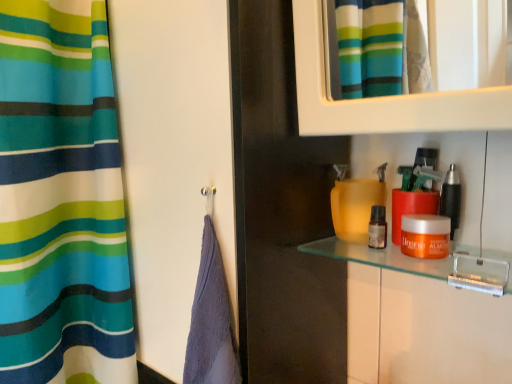
The image size is (512, 384). I want to click on transparent glass screen door at center, so click(x=173, y=159).

Measure the distance between point (379, 247) and camera.

They are 25.67 inches apart.

Describe the element at coordinates (425, 236) in the screenshot. I see `orange matte jar at right, which appears as the second cosmetic when viewed from the right` at that location.

The width and height of the screenshot is (512, 384). I want to click on translucent glass shelf at center, so click(388, 256).

What do you see at coordinates (388, 256) in the screenshot?
I see `translucent glass shelf at center` at bounding box center [388, 256].

Locate an element on the screen. The image size is (512, 384). metallic black razor at right, the 3th cosmetic in the left-to-right sequence is located at coordinates (451, 198).

From the image's perspective, does transparent glass screen door at center appear higher than metallic black razor at right, the first cosmetic viewed from the right?

No, from the image's perspective, transparent glass screen door at center is not over metallic black razor at right, the first cosmetic viewed from the right.

Relative to metallic black razor at right, the 3th cosmetic in the left-to-right sequence, is transparent glass screen door at center in front or behind?

Visually, transparent glass screen door at center is located in front of metallic black razor at right, the 3th cosmetic in the left-to-right sequence.

Is transparent glass screen door at center bigger than metallic black razor at right, the first cosmetic viewed from the right?

Yes, transparent glass screen door at center is bigger than metallic black razor at right, the first cosmetic viewed from the right.

Is translucent amber bottle at center, marked as the 1th cosmetic in a left-to-right arrangement, at the right side of orange matte jar at right, which ranks as the 2th cosmetic in left-to-right order?

No, translucent amber bottle at center, marked as the 1th cosmetic in a left-to-right arrangement, is not to the right of orange matte jar at right, which ranks as the 2th cosmetic in left-to-right order.

Considering the relative sizes of translucent amber bottle at center, marked as the 1th cosmetic in a left-to-right arrangement, and orange matte jar at right, which ranks as the 2th cosmetic in left-to-right order, in the image provided, is translucent amber bottle at center, marked as the 1th cosmetic in a left-to-right arrangement, wider than orange matte jar at right, which ranks as the 2th cosmetic in left-to-right order,?

In fact, translucent amber bottle at center, marked as the 1th cosmetic in a left-to-right arrangement, might be narrower than orange matte jar at right, which ranks as the 2th cosmetic in left-to-right order.

From the image's perspective, which object appears higher, translucent amber bottle at center, the 3th cosmetic in the right-to-left sequence, or orange matte jar at right, which appears as the second cosmetic when viewed from the right?

translucent amber bottle at center, the 3th cosmetic in the right-to-left sequence, is shown above in the image.

Which of these two, translucent amber bottle at center, marked as the 1th cosmetic in a left-to-right arrangement, or orange matte jar at right, which appears as the second cosmetic when viewed from the right, stands taller?

translucent amber bottle at center, marked as the 1th cosmetic in a left-to-right arrangement, is taller.

Considering the sizes of transparent glass screen door at center and translucent amber bottle at center, marked as the 1th cosmetic in a left-to-right arrangement, in the image, is transparent glass screen door at center wider or thinner than translucent amber bottle at center, marked as the 1th cosmetic in a left-to-right arrangement,?

Considering their sizes, transparent glass screen door at center looks broader than translucent amber bottle at center, marked as the 1th cosmetic in a left-to-right arrangement.

Does transparent glass screen door at center appear on the left side of translucent amber bottle at center, the 3th cosmetic in the right-to-left sequence?

Indeed, transparent glass screen door at center is positioned on the left side of translucent amber bottle at center, the 3th cosmetic in the right-to-left sequence.

How much distance is there between transparent glass screen door at center and translucent amber bottle at center, the 3th cosmetic in the right-to-left sequence?

transparent glass screen door at center is 13.84 inches away from translucent amber bottle at center, the 3th cosmetic in the right-to-left sequence.

From the image's perspective, is transparent glass screen door at center above translucent amber bottle at center, marked as the 1th cosmetic in a left-to-right arrangement?

Yes, from the image's perspective, transparent glass screen door at center is on top of translucent amber bottle at center, marked as the 1th cosmetic in a left-to-right arrangement.

Can you tell me how much orange matte jar at right, which appears as the second cosmetic when viewed from the right, and translucent amber bottle at center, the 3th cosmetic in the right-to-left sequence, differ in facing direction?

The facing directions of orange matte jar at right, which appears as the second cosmetic when viewed from the right, and translucent amber bottle at center, the 3th cosmetic in the right-to-left sequence, are 2.64 degrees apart.

Starting from the orange matte jar at right, which appears as the second cosmetic when viewed from the right, which cosmetic is the 2nd one behind? Please provide its 2D coordinates.

[(377, 228)]

Considering the sizes of orange matte jar at right, which ranks as the 2th cosmetic in left-to-right order, and translucent amber bottle at center, the 3th cosmetic in the right-to-left sequence, in the image, is orange matte jar at right, which ranks as the 2th cosmetic in left-to-right order, bigger or smaller than translucent amber bottle at center, the 3th cosmetic in the right-to-left sequence,?

In the image, orange matte jar at right, which ranks as the 2th cosmetic in left-to-right order, appears to be larger than translucent amber bottle at center, the 3th cosmetic in the right-to-left sequence.

Does orange matte jar at right, which ranks as the 2th cosmetic in left-to-right order, appear on the left side of translucent amber bottle at center, the 3th cosmetic in the right-to-left sequence?

No, orange matte jar at right, which ranks as the 2th cosmetic in left-to-right order, is not to the left of translucent amber bottle at center, the 3th cosmetic in the right-to-left sequence.

How far apart are translucent amber bottle at center, marked as the 1th cosmetic in a left-to-right arrangement, and transparent glass screen door at center?

translucent amber bottle at center, marked as the 1th cosmetic in a left-to-right arrangement, is 13.84 inches from transparent glass screen door at center.

Which is more to the right, translucent amber bottle at center, the 3th cosmetic in the right-to-left sequence, or transparent glass screen door at center?

From the viewer's perspective, translucent amber bottle at center, the 3th cosmetic in the right-to-left sequence, appears more on the right side.

Is translucent amber bottle at center, marked as the 1th cosmetic in a left-to-right arrangement, bigger than transparent glass screen door at center?

Actually, translucent amber bottle at center, marked as the 1th cosmetic in a left-to-right arrangement, might be smaller than transparent glass screen door at center.

How different are the orientations of translucent amber bottle at center, marked as the 1th cosmetic in a left-to-right arrangement, and transparent glass screen door at center in degrees?

There is a 0.441-degree angle between the facing directions of translucent amber bottle at center, marked as the 1th cosmetic in a left-to-right arrangement, and transparent glass screen door at center.

Is metallic black razor at right, the first cosmetic viewed from the right, touching translucent glass shelf at center?

No, metallic black razor at right, the first cosmetic viewed from the right, is not making contact with translucent glass shelf at center.

Is metallic black razor at right, the first cosmetic viewed from the right, taller than translucent glass shelf at center?

Yes, metallic black razor at right, the first cosmetic viewed from the right, is taller than translucent glass shelf at center.

How different are the orientations of metallic black razor at right, the 3th cosmetic in the left-to-right sequence, and translucent glass shelf at center in degrees?

There is a 0.00383-degree angle between the facing directions of metallic black razor at right, the 3th cosmetic in the left-to-right sequence, and translucent glass shelf at center.

Considering the sizes of objects metallic black razor at right, the first cosmetic viewed from the right, and translucent glass shelf at center in the image provided, who is bigger, metallic black razor at right, the first cosmetic viewed from the right, or translucent glass shelf at center?

translucent glass shelf at center is bigger.

Can you confirm if metallic black razor at right, the 3th cosmetic in the left-to-right sequence, is smaller than transparent glass screen door at center?

Yes, metallic black razor at right, the 3th cosmetic in the left-to-right sequence, is smaller than transparent glass screen door at center.

Are metallic black razor at right, the 3th cosmetic in the left-to-right sequence, and transparent glass screen door at center located far from each other?

They are positioned close to each other.

Is transparent glass screen door at center at the back of metallic black razor at right, the first cosmetic viewed from the right?

No, metallic black razor at right, the first cosmetic viewed from the right, is not facing the opposite direction of transparent glass screen door at center.

What are the coordinates of `screen door below the metallic black razor at right, the first cosmetic viewed from the right (from a real-world perspective)` in the screenshot? It's located at click(173, 159).

Image resolution: width=512 pixels, height=384 pixels. In order to click on cosmetic that is the 2nd object located behind the orange matte jar at right, which ranks as the 2th cosmetic in left-to-right order in this screenshot , I will do `click(377, 228)`.

Estimate the real-world distances between objects in this image. Which object is further from orange matte jar at right, which ranks as the 2th cosmetic in left-to-right order, transparent glass screen door at center or metallic black razor at right, the first cosmetic viewed from the right?

transparent glass screen door at center lies further to orange matte jar at right, which ranks as the 2th cosmetic in left-to-right order, than the other object.

From the image, which object appears to be nearer to translucent glass shelf at center, orange matte jar at right, which ranks as the 2th cosmetic in left-to-right order, or transparent glass screen door at center?

Based on the image, orange matte jar at right, which ranks as the 2th cosmetic in left-to-right order, appears to be nearer to translucent glass shelf at center.

When comparing their distances from metallic black razor at right, the first cosmetic viewed from the right, does transparent glass screen door at center or translucent amber bottle at center, the 3th cosmetic in the right-to-left sequence, seem closer?

The object closer to metallic black razor at right, the first cosmetic viewed from the right, is translucent amber bottle at center, the 3th cosmetic in the right-to-left sequence.

Estimate the real-world distances between objects in this image. Which object is further from metallic black razor at right, the 3th cosmetic in the left-to-right sequence, translucent glass shelf at center or transparent glass screen door at center?

Based on the image, transparent glass screen door at center appears to be further to metallic black razor at right, the 3th cosmetic in the left-to-right sequence.

Looking at the image, which one is located closer to transparent glass screen door at center, translucent amber bottle at center, marked as the 1th cosmetic in a left-to-right arrangement, or metallic black razor at right, the first cosmetic viewed from the right?

translucent amber bottle at center, marked as the 1th cosmetic in a left-to-right arrangement, is positioned closer to the anchor transparent glass screen door at center.

Which object lies nearer to the anchor point transparent glass screen door at center, translucent glass shelf at center or orange matte jar at right, which ranks as the 2th cosmetic in left-to-right order?

translucent glass shelf at center lies closer to transparent glass screen door at center than the other object.

In the scene shown: When comparing their distances from metallic black razor at right, the first cosmetic viewed from the right, does orange matte jar at right, which appears as the second cosmetic when viewed from the right, or translucent glass shelf at center seem further?

translucent glass shelf at center is positioned further to the anchor metallic black razor at right, the first cosmetic viewed from the right.

From the image, which object appears to be farther from metallic black razor at right, the first cosmetic viewed from the right, translucent glass shelf at center or translucent amber bottle at center, marked as the 1th cosmetic in a left-to-right arrangement?

Based on the image, translucent glass shelf at center appears to be further to metallic black razor at right, the first cosmetic viewed from the right.

Where is `counter top situated between transparent glass screen door at center and orange matte jar at right, which appears as the second cosmetic when viewed from the right, from left to right`? The height and width of the screenshot is (384, 512). counter top situated between transparent glass screen door at center and orange matte jar at right, which appears as the second cosmetic when viewed from the right, from left to right is located at coordinates (388, 256).

You are a GUI agent. You are given a task and a screenshot of the screen. Output one action in this format:
    pyautogui.click(x=<x>, y=<y>)
    Task: Click on the cosmetic positioned between translucent glass shelf at center and metallic black razor at right, the first cosmetic viewed from the right, from near to far
    
    Given the screenshot: What is the action you would take?
    pyautogui.click(x=425, y=236)

The image size is (512, 384). What are the coordinates of `cosmetic between transparent glass screen door at center and orange matte jar at right, which ranks as the 2th cosmetic in left-to-right order` in the screenshot? It's located at (377, 228).

I want to click on cosmetic between translucent amber bottle at center, marked as the 1th cosmetic in a left-to-right arrangement, and metallic black razor at right, the 3th cosmetic in the left-to-right sequence, in the horizontal direction, so click(x=425, y=236).